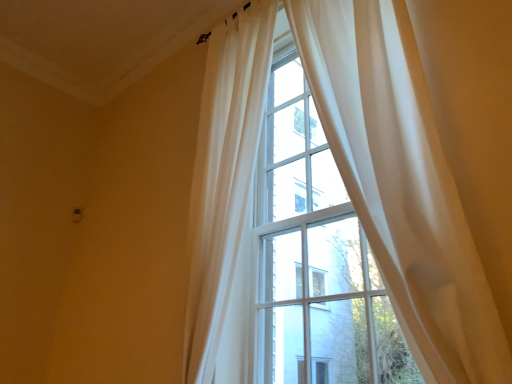
Question: Is sheer white curtain at upper right, which is the second curtain in left-to-right order, aimed at sheer white curtain at upper center, arranged as the 1th curtain when viewed from the left?

Choices:
 (A) no
 (B) yes

Answer: (A)

Question: Is sheer white curtain at upper right, which is the second curtain in left-to-right order, oriented away from sheer white curtain at upper center, arranged as the 1th curtain when viewed from the left?

Choices:
 (A) no
 (B) yes

Answer: (A)

Question: Can you confirm if sheer white curtain at upper right, which is counted as the first curtain, starting from the right, is shorter than sheer white curtain at upper center, which is the second curtain from right to left?

Choices:
 (A) yes
 (B) no

Answer: (A)

Question: Is the position of sheer white curtain at upper right, which is counted as the first curtain, starting from the right, more distant than that of sheer white curtain at upper center, which is the second curtain from right to left?

Choices:
 (A) no
 (B) yes

Answer: (A)

Question: Is sheer white curtain at upper right, which is the second curtain in left-to-right order, closer to camera compared to sheer white curtain at upper center, arranged as the 1th curtain when viewed from the left?

Choices:
 (A) no
 (B) yes

Answer: (B)

Question: From a real-world perspective, is sheer white curtain at upper right, which is the second curtain in left-to-right order, beneath sheer white curtain at upper center, arranged as the 1th curtain when viewed from the left?

Choices:
 (A) yes
 (B) no

Answer: (A)

Question: Is sheer white curtain at upper center, arranged as the 1th curtain when viewed from the left, positioned beyond the bounds of sheer white curtain at upper right, which is counted as the first curtain, starting from the right?

Choices:
 (A) no
 (B) yes

Answer: (B)

Question: From the image's perspective, is sheer white curtain at upper center, which is the second curtain from right to left, beneath sheer white curtain at upper right, which is the second curtain in left-to-right order?

Choices:
 (A) yes
 (B) no

Answer: (A)

Question: Considering the relative positions of sheer white curtain at upper center, which is the second curtain from right to left, and sheer white curtain at upper right, which is the second curtain in left-to-right order, in the image provided, is sheer white curtain at upper center, which is the second curtain from right to left, to the left of sheer white curtain at upper right, which is the second curtain in left-to-right order, from the viewer's perspective?

Choices:
 (A) yes
 (B) no

Answer: (A)

Question: Is sheer white curtain at upper center, arranged as the 1th curtain when viewed from the left, facing away from sheer white curtain at upper right, which is counted as the first curtain, starting from the right?

Choices:
 (A) yes
 (B) no

Answer: (B)

Question: From the image's perspective, does sheer white curtain at upper center, arranged as the 1th curtain when viewed from the left, appear higher than sheer white curtain at upper right, which is the second curtain in left-to-right order?

Choices:
 (A) yes
 (B) no

Answer: (B)

Question: Is sheer white curtain at upper center, arranged as the 1th curtain when viewed from the left, touching sheer white curtain at upper right, which is the second curtain in left-to-right order?

Choices:
 (A) no
 (B) yes

Answer: (A)

Question: Considering the positions of point (402, 14) and point (245, 117), is point (402, 14) closer or farther from the camera than point (245, 117)?

Choices:
 (A) farther
 (B) closer

Answer: (B)